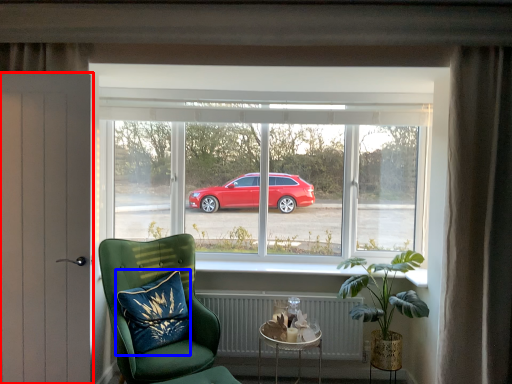
Question: Which of the following is the farthest to the observer, door (highlighted by a red box) or pillow (highlighted by a blue box)?

Choices:
 (A) door
 (B) pillow

Answer: (B)